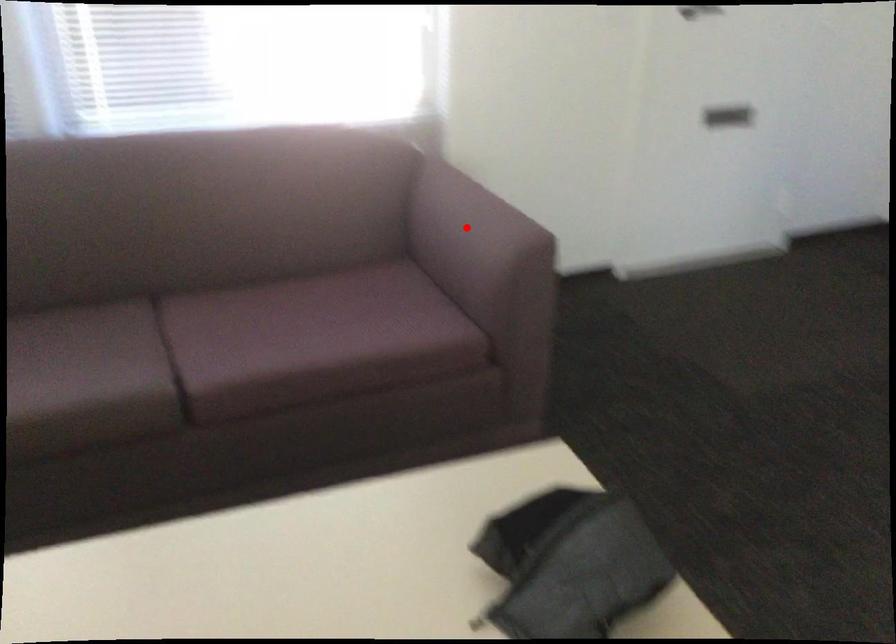
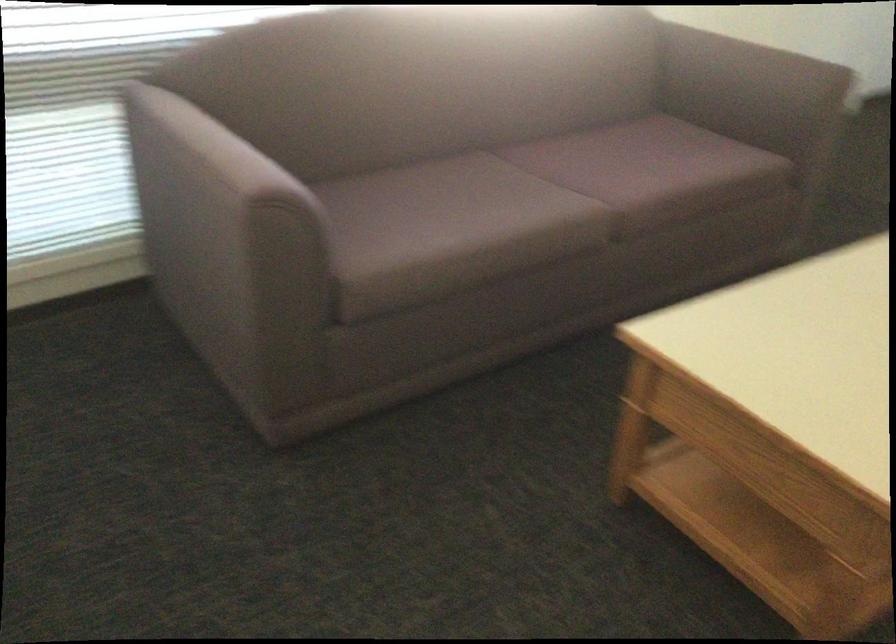
Question: I am providing you with two images of the same scene from different viewpoints. In image1, a red point is highlighted. Considering the same 3D point in image2, which of the following is correct?

Choices:
 (A) It is closer
 (B) It is farther

Answer: (B)